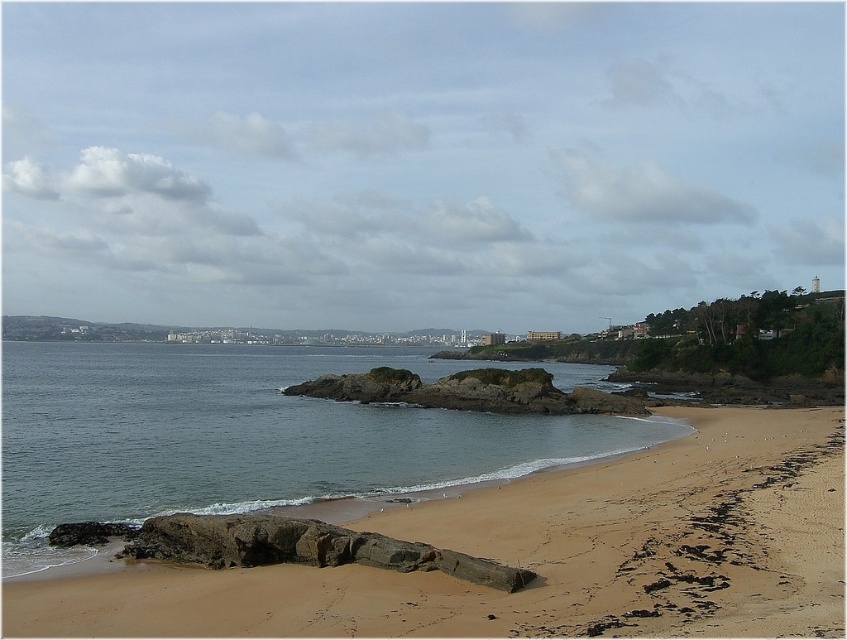
Question: Which of these objects is positioned closest to the brown sandy beach at lower center?

Choices:
 (A) clear water at beach center
 (B) brown rocky island at center

Answer: (B)

Question: Is brown sandy beach at lower center wider than brown rocky island at center?

Choices:
 (A) yes
 (B) no

Answer: (B)

Question: Does brown sandy beach at lower center lie in front of brown rocky island at center?

Choices:
 (A) no
 (B) yes

Answer: (B)

Question: Which of the following is the closest to the observer?

Choices:
 (A) clear water at beach center
 (B) brown sandy beach at lower center
 (C) brown rocky island at center

Answer: (B)

Question: Can you confirm if brown sandy beach at lower center is bigger than clear water at beach center?

Choices:
 (A) no
 (B) yes

Answer: (A)

Question: Which point appears closest to the camera in this image?

Choices:
 (A) (641, 404)
 (B) (460, 436)

Answer: (B)